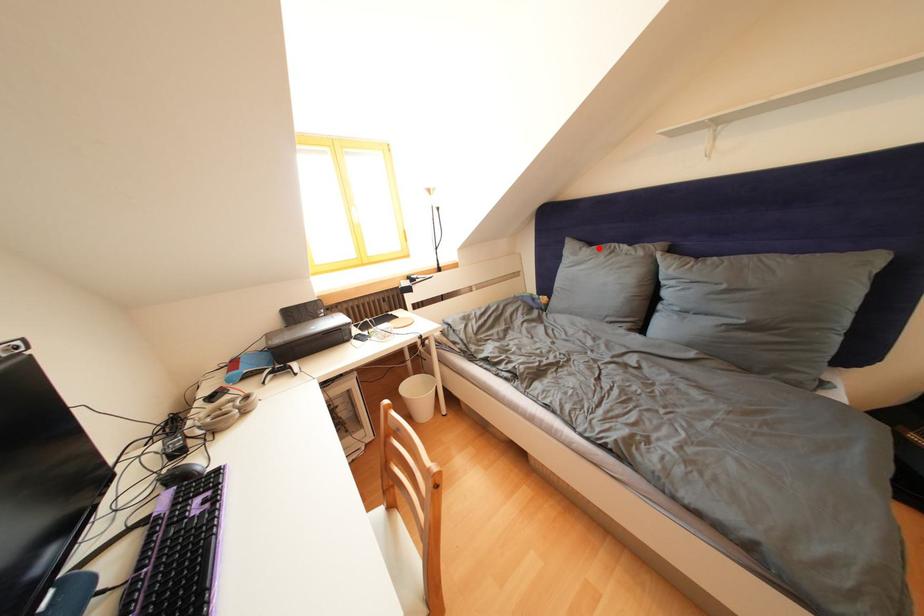
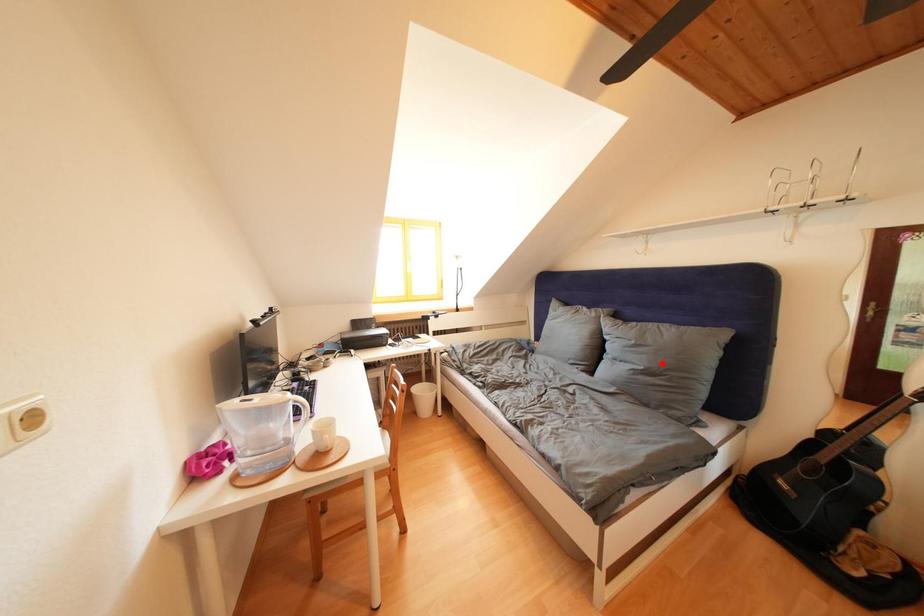
I am providing you with two images of the same scene from different viewpoints. A red point is marked on the first image and another point is marked on the second image. Is the red point in image1 aligned with the point shown in image2?

No